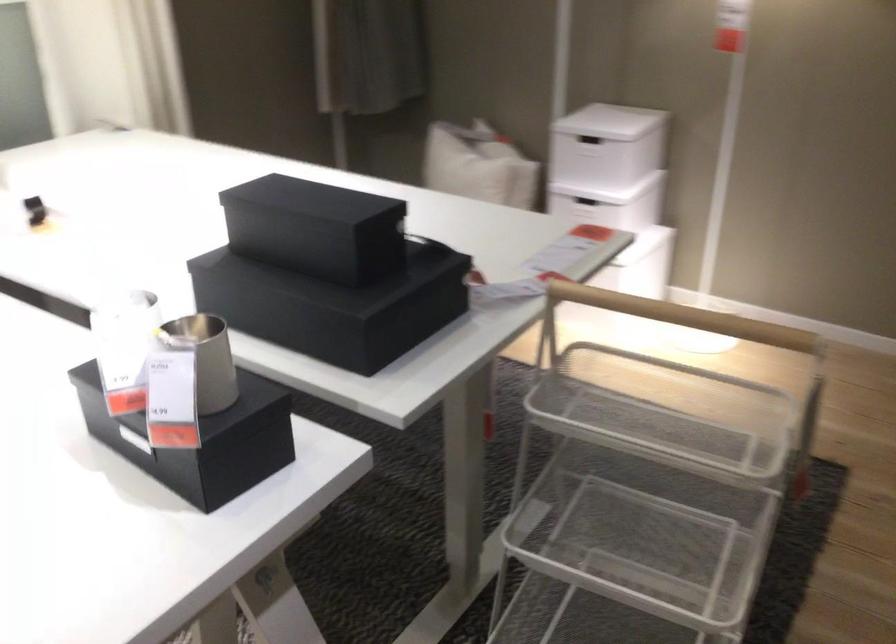
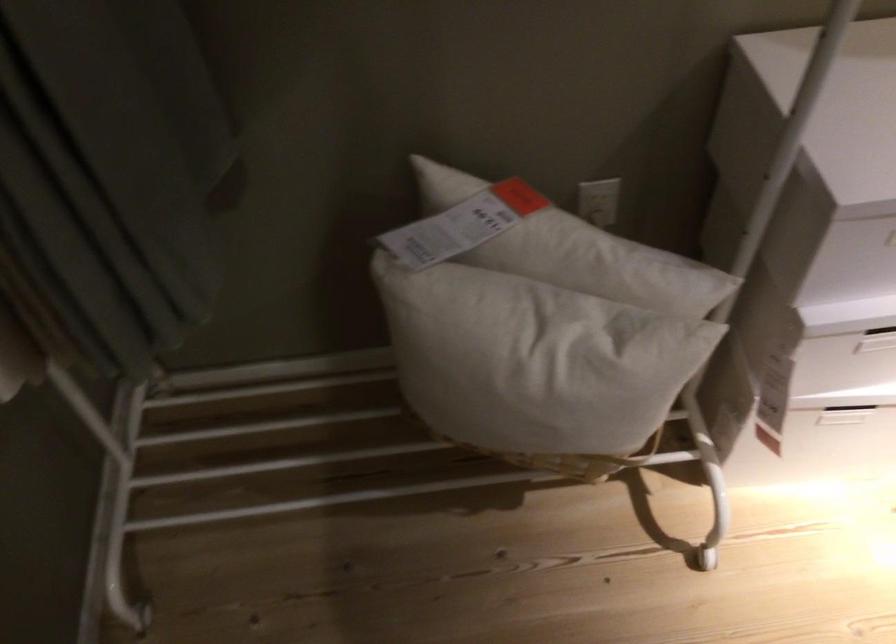
Locate, in the second image, the point that corresponds to point 506,147 in the first image.

(572, 249)